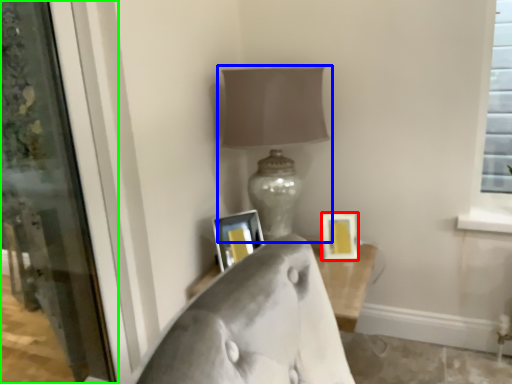
Question: Based on their relative distances, which object is nearer to picture frame (highlighted by a red box)? Choose from lamp (highlighted by a blue box) and screen door (highlighted by a green box).

Choices:
 (A) lamp
 (B) screen door

Answer: (A)